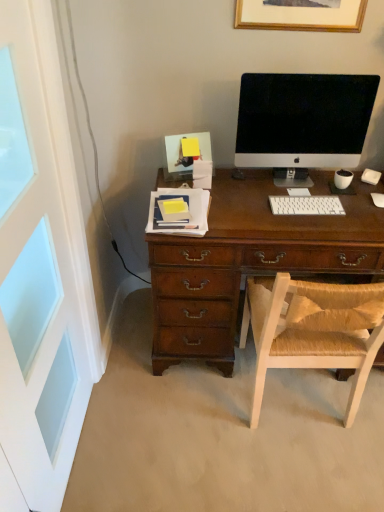
Question: Is light brown woven chair at center aimed at satin black monitor at center?

Choices:
 (A) no
 (B) yes

Answer: (A)

Question: Are light brown woven chair at center and satin black monitor at center making contact?

Choices:
 (A) no
 (B) yes

Answer: (A)

Question: Can you confirm if light brown woven chair at center is taller than satin black monitor at center?

Choices:
 (A) no
 (B) yes

Answer: (B)

Question: Is light brown woven chair at center not inside satin black monitor at center?

Choices:
 (A) yes
 (B) no

Answer: (A)

Question: Is there a large distance between light brown woven chair at center and satin black monitor at center?

Choices:
 (A) yes
 (B) no

Answer: (B)

Question: From a real-world perspective, is white painted wood screen door at left positioned above or below satin black monitor at center?

Choices:
 (A) above
 (B) below

Answer: (B)

Question: Relative to satin black monitor at center, is white painted wood screen door at left in front or behind?

Choices:
 (A) front
 (B) behind

Answer: (A)

Question: Is white painted wood screen door at left to the left or to the right of satin black monitor at center in the image?

Choices:
 (A) left
 (B) right

Answer: (A)

Question: Looking at their shapes, would you say white painted wood screen door at left is wider or thinner than satin black monitor at center?

Choices:
 (A) wide
 (B) thin

Answer: (B)

Question: Does point (268, 7) appear closer or farther from the camera than point (314, 200)?

Choices:
 (A) closer
 (B) farther

Answer: (A)

Question: Is wooden picture frame at upper center spatially inside white plastic keyboard at center, or outside of it?

Choices:
 (A) inside
 (B) outside

Answer: (B)

Question: Considering the positions of wooden picture frame at upper center and white plastic keyboard at center in the image, is wooden picture frame at upper center wider or thinner than white plastic keyboard at center?

Choices:
 (A) wide
 (B) thin

Answer: (B)

Question: In terms of height, does wooden picture frame at upper center look taller or shorter compared to white plastic keyboard at center?

Choices:
 (A) tall
 (B) short

Answer: (A)

Question: Is white plastic keyboard at center in front of or behind white painted wood screen door at left in the image?

Choices:
 (A) behind
 (B) front

Answer: (A)

Question: Is point (309, 197) closer or farther from the camera than point (49, 328)?

Choices:
 (A) farther
 (B) closer

Answer: (A)